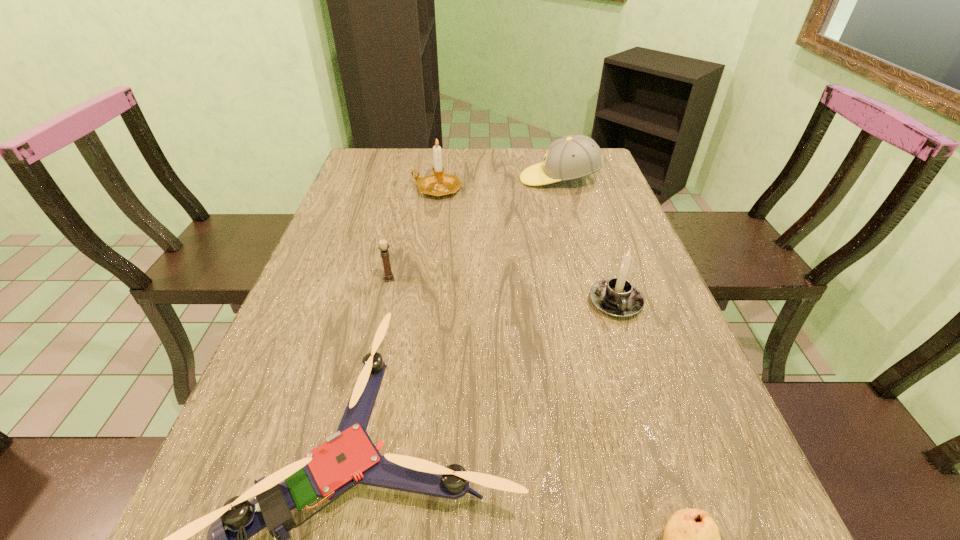
Where is `free region at the far left corner of the desktop`? free region at the far left corner of the desktop is located at coordinates (378, 180).

Identify the location of free space between the fourth nearest object and the farthest candle holder. (413, 234).

Where is `free space that is in between the third shortest object and the baseball cap`? free space that is in between the third shortest object and the baseball cap is located at coordinates (474, 229).

You are a GUI agent. You are given a task and a screenshot of the screen. Output one action in this format:
    pyautogui.click(x=<x>, y=<y>)
    Task: Click on the blank region between the farthest candle holder and the nearest candle holder
    Image resolution: width=960 pixels, height=540 pixels.
    Given the screenshot: What is the action you would take?
    pyautogui.click(x=526, y=246)

Locate an element on the screen. The width and height of the screenshot is (960, 540). free space that is in between the baseball cap and the farthest candle holder is located at coordinates (498, 184).

Identify which object is located as the second nearest to the fourth farthest object. Please provide its 2D coordinates. Your answer should be formatted as a tuple, i.e. [(x, y)], where the tuple contains the x and y coordinates of a point satisfying the conditions above.

[(691, 539)]

Locate which object ranks third in proximity to the fourth tallest object. Please provide its 2D coordinates. Your answer should be formatted as a tuple, i.e. [(x, y)], where the tuple contains the x and y coordinates of a point satisfying the conditions above.

[(617, 297)]

Choose which candle holder is the second nearest neighbor to the farthest candle holder. Please provide its 2D coordinates. Your answer should be formatted as a tuple, i.e. [(x, y)], where the tuple contains the x and y coordinates of a point satisfying the conditions above.

[(617, 297)]

Locate an element on the screen. The height and width of the screenshot is (540, 960). candle holder that is the third nearest to the baseball cap is located at coordinates (383, 247).